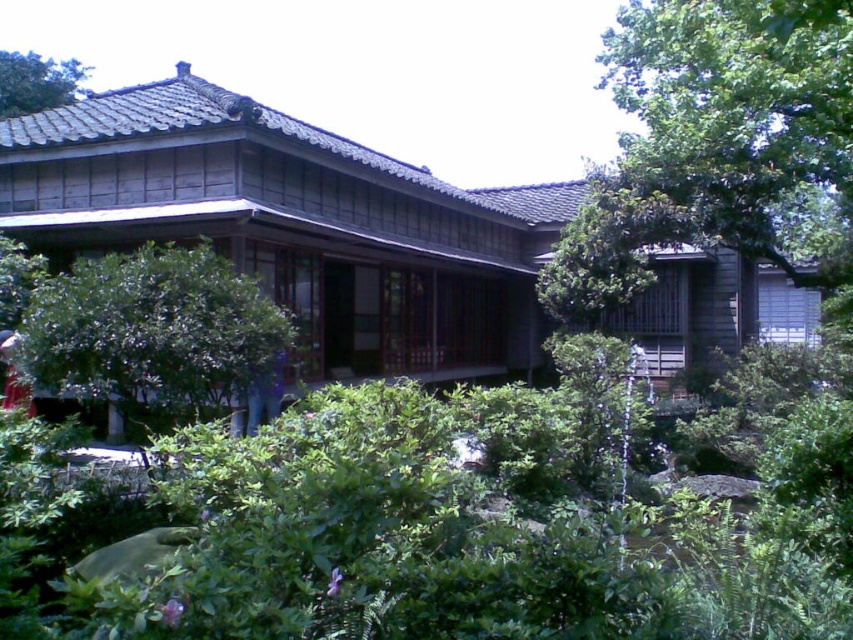
Looking at this image, does green leafy bush at center have a greater height compared to green leafy tree at upper left?

Incorrect, green leafy bush at center's height is not larger of green leafy tree at upper left's.

Which of these two, green leafy bush at center or green leafy tree at upper left, stands shorter?

green leafy bush at center is shorter.

Between point (155, 326) and point (49, 102), which one is positioned in front?

Point (155, 326)

Find the location of `green leafy bush at center`. green leafy bush at center is located at coordinates (149, 332).